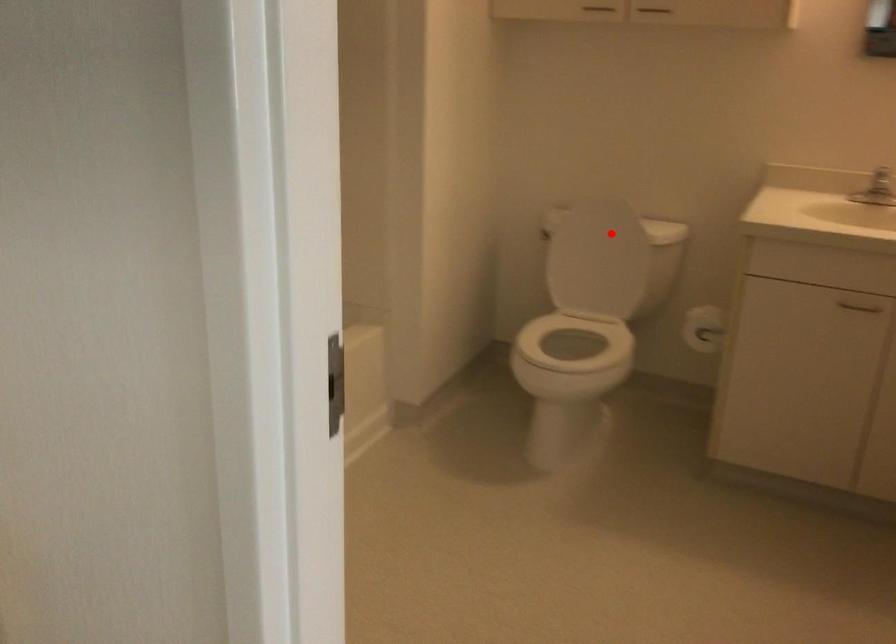
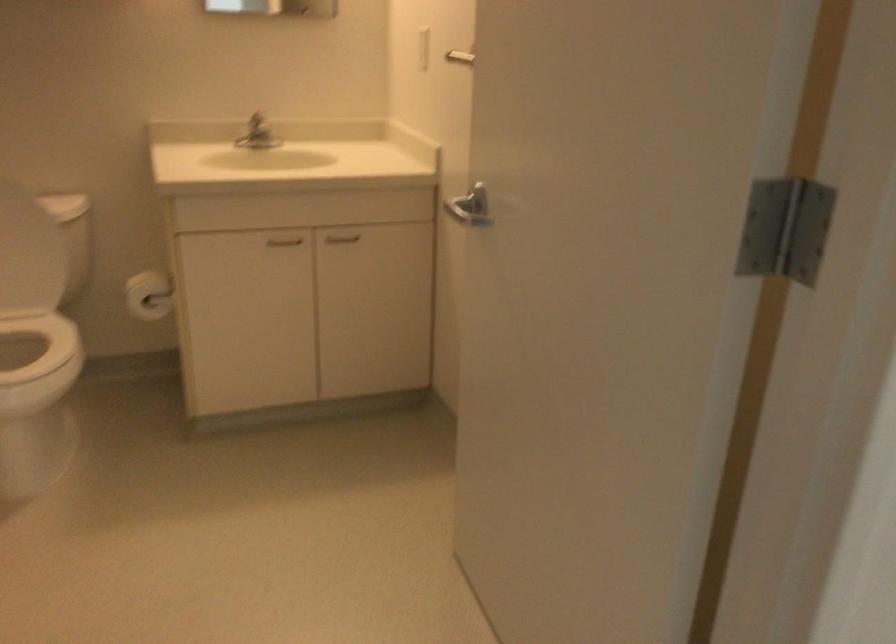
The point at the highlighted location is marked in the first image. Where is the corresponding point in the second image?

(12, 210)